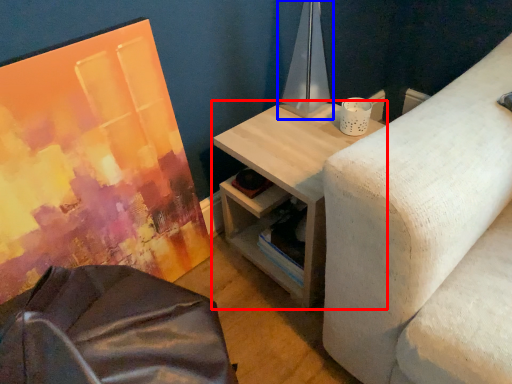
Question: Which object is further to the camera taking this photo, table (highlighted by a red box) or table lamp (highlighted by a blue box)?

Choices:
 (A) table
 (B) table lamp

Answer: (B)